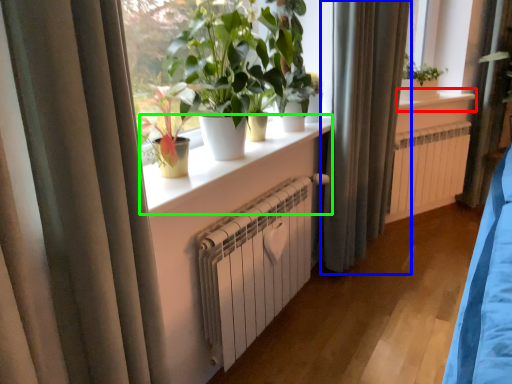
Question: Estimate the real-world distances between objects in this image. Which object is closer to window sill (highlighted by a red box), curtain (highlighted by a blue box) or window sill (highlighted by a green box)?

Choices:
 (A) curtain
 (B) window sill

Answer: (A)